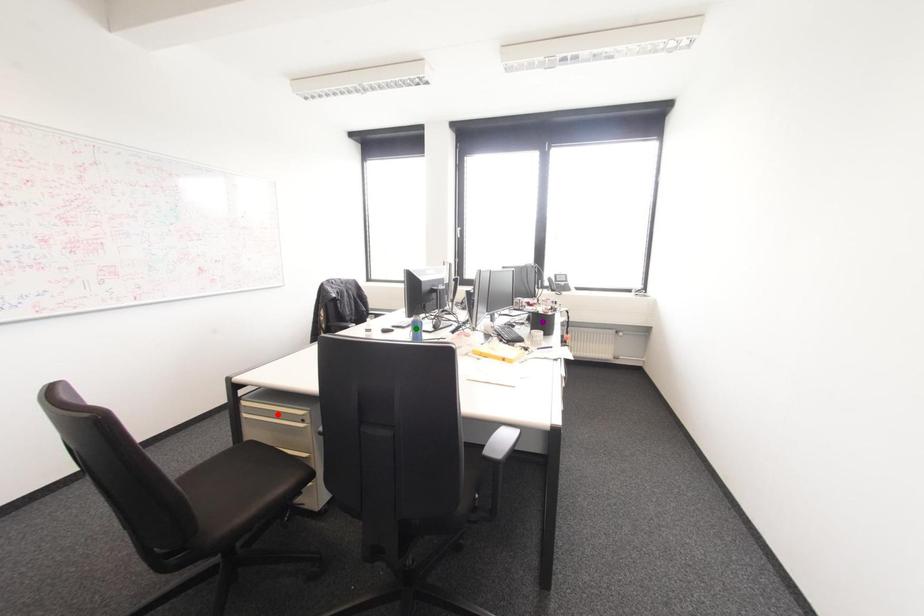
Order these from nearest to farthest:
green point
purple point
red point

red point → green point → purple point